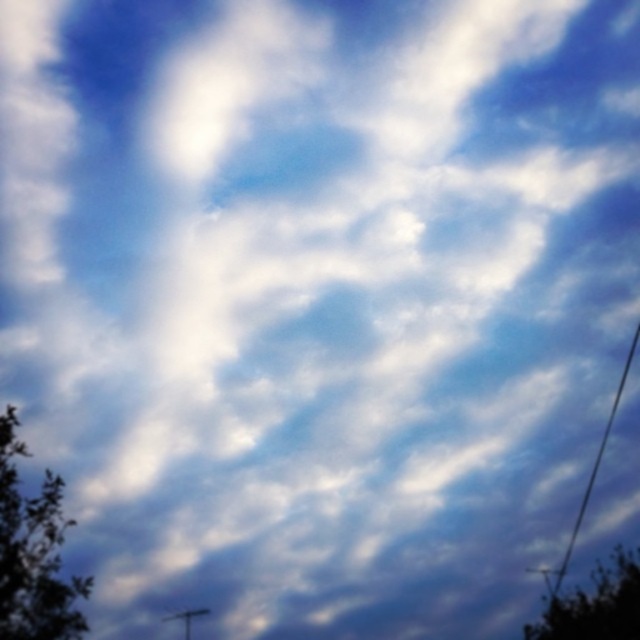
Question: Does green leafy tree at lower left appear under green leafy tree at lower right?

Choices:
 (A) yes
 (B) no

Answer: (B)

Question: Among these objects, which one is farthest from the camera?

Choices:
 (A) green leafy tree at lower left
 (B) green leafy tree at lower right

Answer: (B)

Question: Is green leafy tree at lower left to the right of green leafy tree at lower right from the viewer's perspective?

Choices:
 (A) yes
 (B) no

Answer: (B)

Question: Does green leafy tree at lower left appear under green leafy tree at lower right?

Choices:
 (A) no
 (B) yes

Answer: (A)

Question: Which of the following is the closest to the observer?

Choices:
 (A) green leafy tree at lower right
 (B) green leafy tree at lower left

Answer: (B)